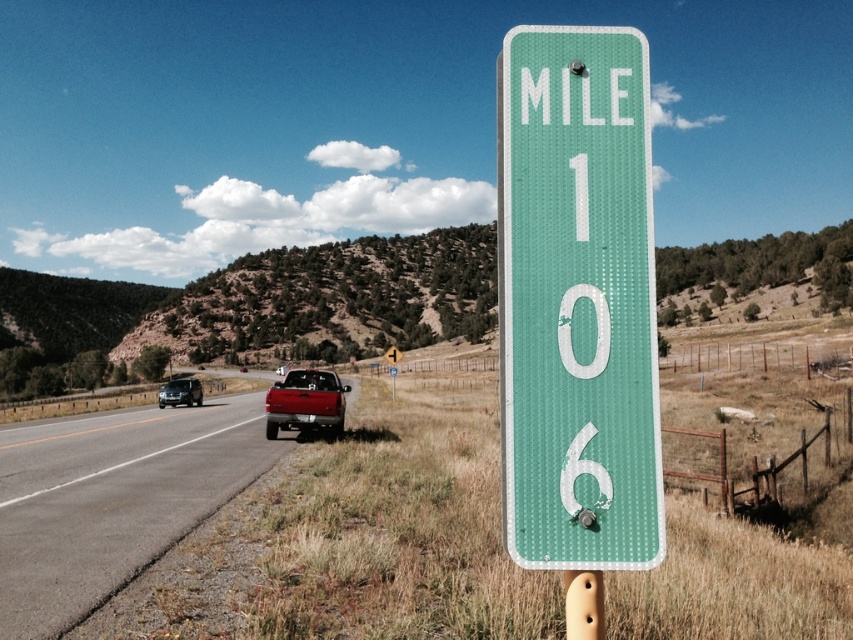
In the scene shown: Can you confirm if green textured sign at center is taller than matte black suv at left?

No.

Which of these two, green textured sign at center or matte black suv at left, stands taller?

matte black suv at left

Image resolution: width=853 pixels, height=640 pixels. What do you see at coordinates (577, 301) in the screenshot?
I see `green textured sign at center` at bounding box center [577, 301].

You are a GUI agent. You are given a task and a screenshot of the screen. Output one action in this format:
    pyautogui.click(x=<x>, y=<y>)
    Task: Click on the green textured sign at center
    
    Given the screenshot: What is the action you would take?
    pyautogui.click(x=577, y=301)

Between matte red truck at center and matte black suv at left, which one appears on the left side from the viewer's perspective?

matte black suv at left is more to the left.

This screenshot has height=640, width=853. In order to click on matte red truck at center in this screenshot , I will do `click(305, 403)`.

Can you confirm if metallic gray truck at center is taller than matte black suv at left?

In fact, metallic gray truck at center may be shorter than matte black suv at left.

The height and width of the screenshot is (640, 853). Describe the element at coordinates (112, 499) in the screenshot. I see `metallic gray truck at center` at that location.

In order to click on metallic gray truck at center in this screenshot , I will do `click(112, 499)`.